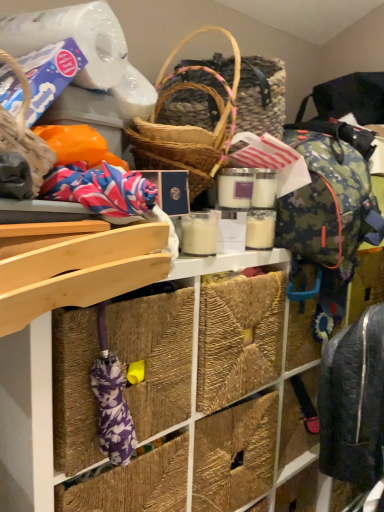
Question: Does point (41, 479) appear closer or farther from the camera than point (377, 326)?

Choices:
 (A) closer
 (B) farther

Answer: (A)

Question: Is natural fiber baskets at upper center to the left or to the right of dark gray quilted backpack at lower right in the image?

Choices:
 (A) left
 (B) right

Answer: (A)

Question: Looking at the image, does natural fiber baskets at upper center seem bigger or smaller compared to dark gray quilted backpack at lower right?

Choices:
 (A) big
 (B) small

Answer: (A)

Question: Relative to natural fiber baskets at upper center, is dark gray quilted backpack at lower right in front or behind?

Choices:
 (A) front
 (B) behind

Answer: (B)

Question: Looking at the image, does dark gray quilted backpack at lower right seem bigger or smaller compared to natural fiber baskets at upper center?

Choices:
 (A) big
 (B) small

Answer: (B)

Question: Is dark gray quilted backpack at lower right wider or thinner than natural fiber baskets at upper center?

Choices:
 (A) thin
 (B) wide

Answer: (A)

Question: Would you say dark gray quilted backpack at lower right is inside or outside natural fiber baskets at upper center?

Choices:
 (A) outside
 (B) inside

Answer: (A)